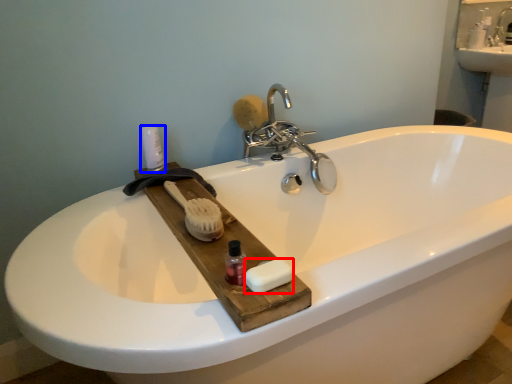
Question: Which point is closer to the camera, soap (highlighted by a red box) or toiletry (highlighted by a blue box)?

Choices:
 (A) soap
 (B) toiletry

Answer: (A)